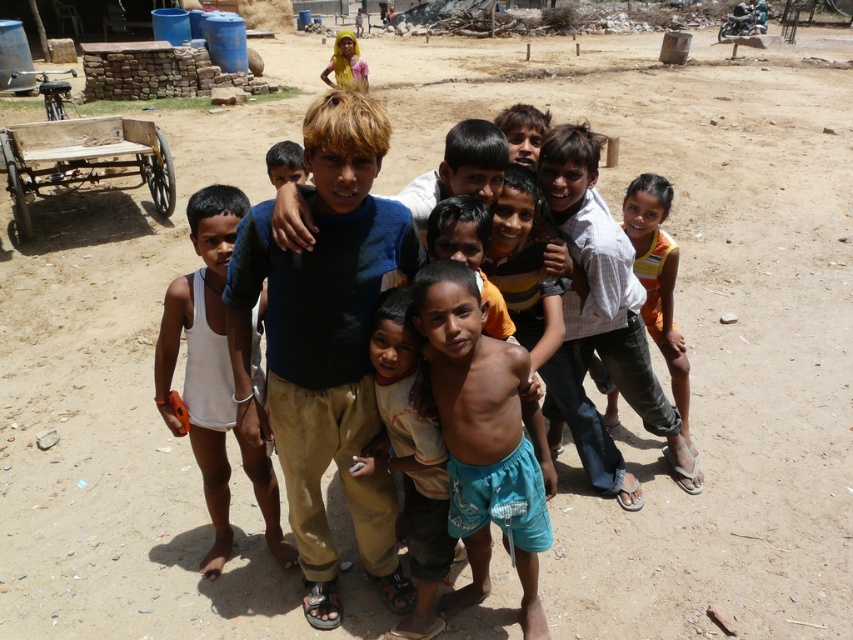
You are a photographer trying to capture a group photo of the children. You notice the blue cotton shirt at center and the orange sleeveless top at right. Which child should you ask to move forward to ensure both are visible in the photo?

The orange sleeveless top at right should move forward because the blue cotton shirt at center is taller than the orange sleeveless top at right, so moving the shorter child forward will help balance their visibility in the photo.